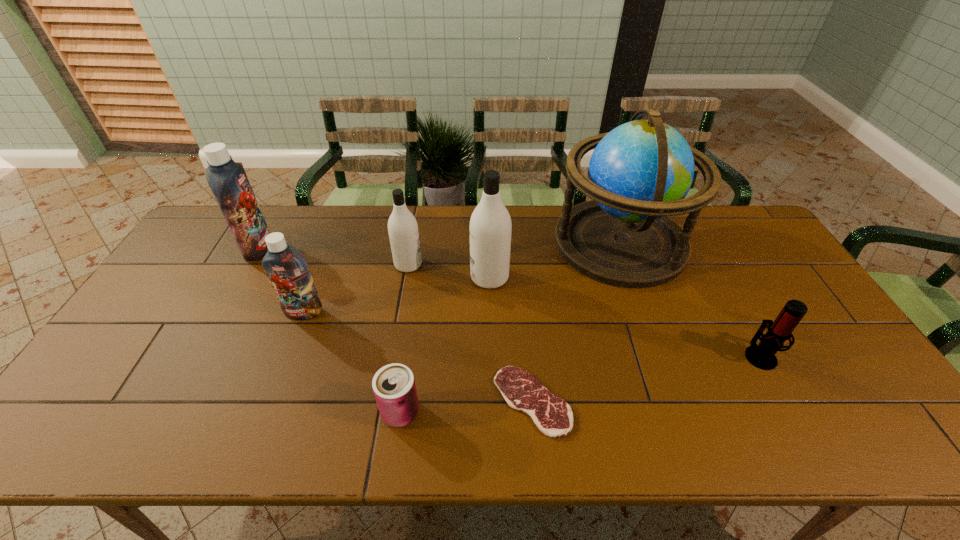
Where is `vacant space that satisfies the following two spatial constraints: 1. on the front-facing side of the red microphone; 2. on the left side of the rightmost shampoo`? The image size is (960, 540). vacant space that satisfies the following two spatial constraints: 1. on the front-facing side of the red microphone; 2. on the left side of the rightmost shampoo is located at coordinates [x=492, y=355].

The image size is (960, 540). Find the location of `free space that satisfies the following two spatial constraints: 1. on the front label of the leftmost shampoo; 2. on the right side of the shortest object`. free space that satisfies the following two spatial constraints: 1. on the front label of the leftmost shampoo; 2. on the right side of the shortest object is located at coordinates (173, 401).

The image size is (960, 540). In order to click on free spot that satisfies the following two spatial constraints: 1. on the front label of the steak; 2. on the right side of the leftmost object in this screenshot , I will do `click(173, 401)`.

The width and height of the screenshot is (960, 540). I want to click on free space that satisfies the following two spatial constraints: 1. on the front label of the nearer blue shampoo; 2. on the right side of the pink can, so click(x=265, y=412).